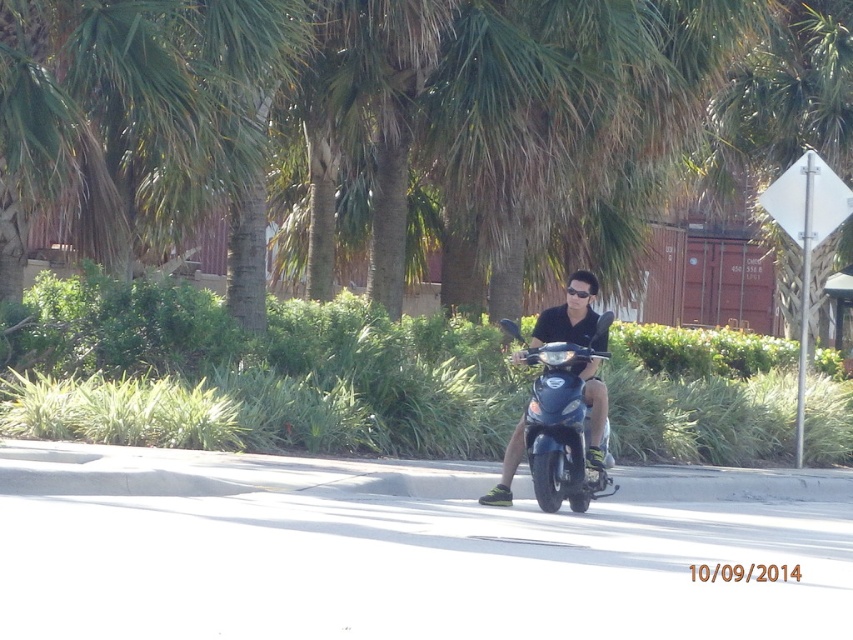
Question: In this image, where is green leafy tree at center located relative to glossy blue scooter at center?

Choices:
 (A) left
 (B) right

Answer: (B)

Question: Which object appears farthest from the camera in this image?

Choices:
 (A) glossy blue scooter at center
 (B) green leafy tree at center

Answer: (B)

Question: Which of the following is the farthest from the observer?

Choices:
 (A) (540, 429)
 (B) (740, 33)

Answer: (B)

Question: Does green leafy tree at center appear over glossy blue scooter at center?

Choices:
 (A) yes
 (B) no

Answer: (A)

Question: Does green leafy tree at center come in front of glossy blue scooter at center?

Choices:
 (A) no
 (B) yes

Answer: (A)

Question: Which point is farther from the camera taking this photo?

Choices:
 (A) tap(757, 160)
 (B) tap(602, 480)

Answer: (A)